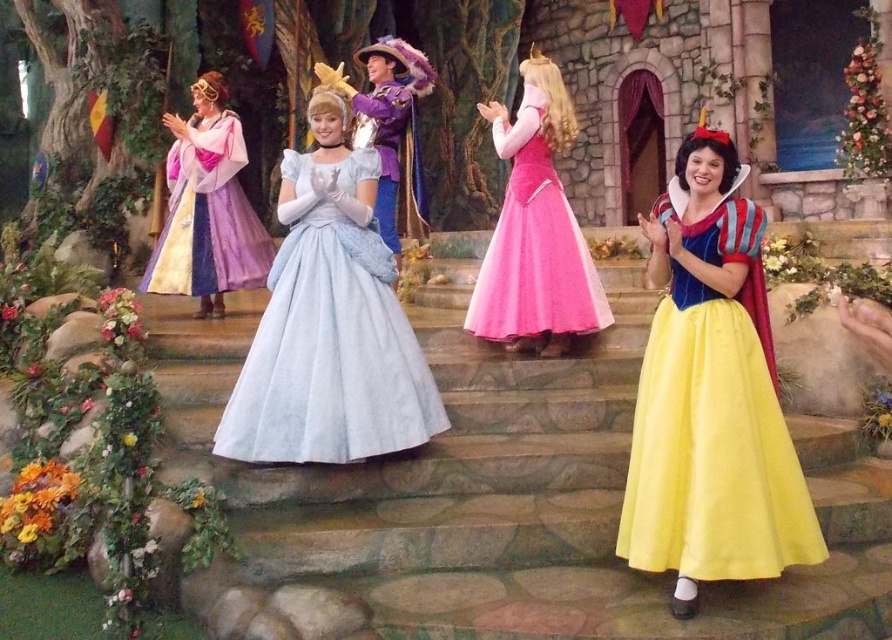
Question: Which of the following is the closest to the observer?

Choices:
 (A) pink satin dress at center
 (B) yellow satin dress at lower right
 (C) pastel purple satin dress at left
 (D) light blue satin dress at center

Answer: (B)

Question: Does light blue satin dress at center have a larger size compared to pastel purple satin dress at left?

Choices:
 (A) yes
 (B) no

Answer: (A)

Question: Which of these objects is positioned closest to the pastel purple satin dress at left?

Choices:
 (A) pink satin dress at center
 (B) light blue satin dress at center
 (C) yellow satin dress at lower right

Answer: (B)

Question: Which of the following is the farthest from the observer?

Choices:
 (A) yellow satin dress at lower right
 (B) pastel purple satin dress at left
 (C) pink satin dress at center
 (D) light blue satin dress at center

Answer: (B)

Question: Does yellow satin dress at lower right have a lesser width compared to light blue satin dress at center?

Choices:
 (A) no
 (B) yes

Answer: (B)

Question: Does yellow satin dress at lower right appear on the right side of pink satin dress at center?

Choices:
 (A) no
 (B) yes

Answer: (B)